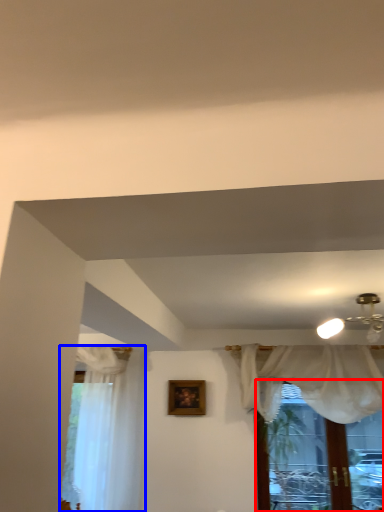
Question: Among these objects, which one is nearest to the camera, window (highlighted by a red box) or curtain (highlighted by a blue box)?

Choices:
 (A) window
 (B) curtain

Answer: (A)